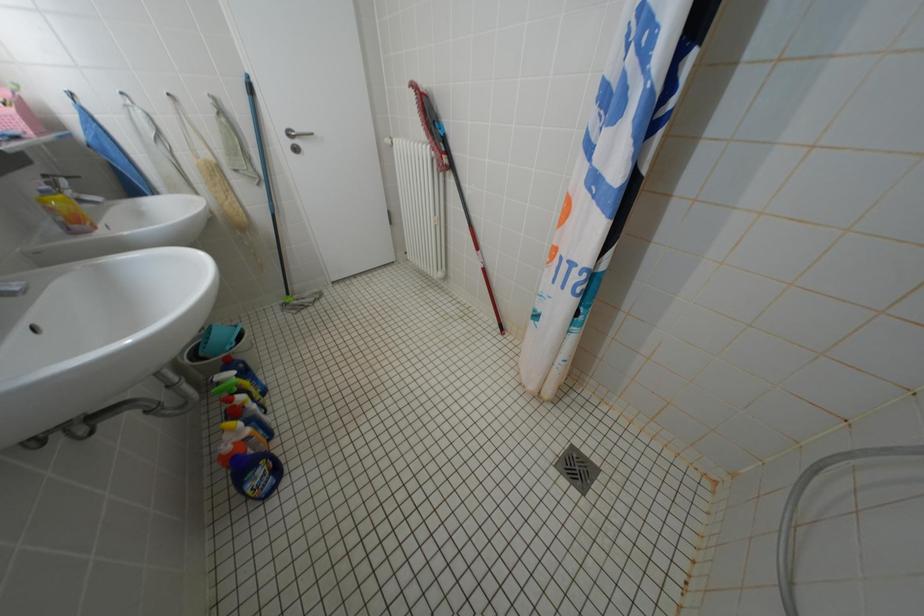
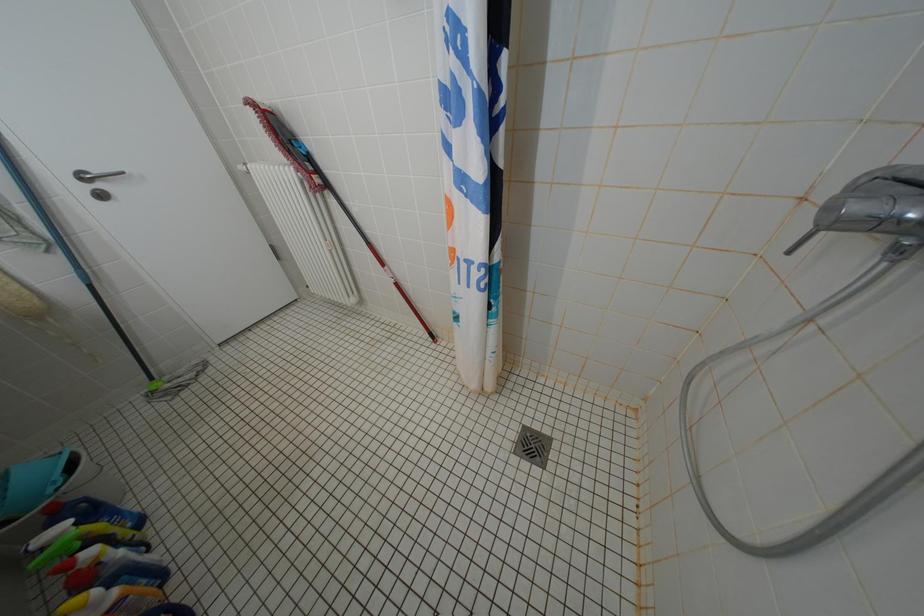
Question: Which direction would the cameraman need to move to produce the second image? Reply with the corresponding letter.

Choices:
 (A) Left
 (B) Right
 (C) Forward
 (D) Backward

Answer: (B)